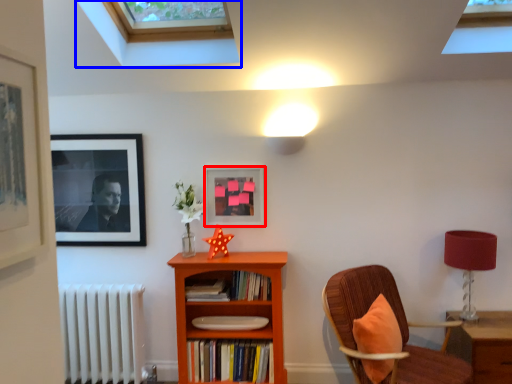
Question: Which point is closer to the camera, picture frame (highlighted by a red box) or window (highlighted by a blue box)?

Choices:
 (A) picture frame
 (B) window

Answer: (B)